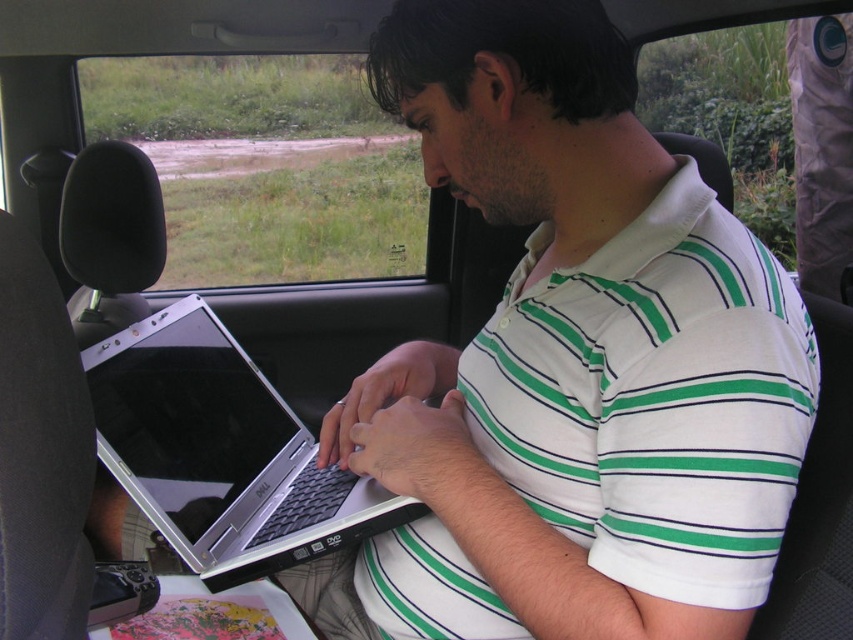
Question: Is white striped polo shirt at center wider than silver metallic laptop at center?

Choices:
 (A) yes
 (B) no

Answer: (A)

Question: Does white striped polo shirt at center appear over silver metallic laptop at center?

Choices:
 (A) yes
 (B) no

Answer: (A)

Question: Is white striped polo shirt at center to the left of silver metallic laptop at center from the viewer's perspective?

Choices:
 (A) yes
 (B) no

Answer: (B)

Question: Which of the following is the farthest from the observer?

Choices:
 (A) (604, 493)
 (B) (312, 451)

Answer: (B)

Question: Which point appears closest to the camera in this image?

Choices:
 (A) (154, 451)
 (B) (569, 291)

Answer: (B)